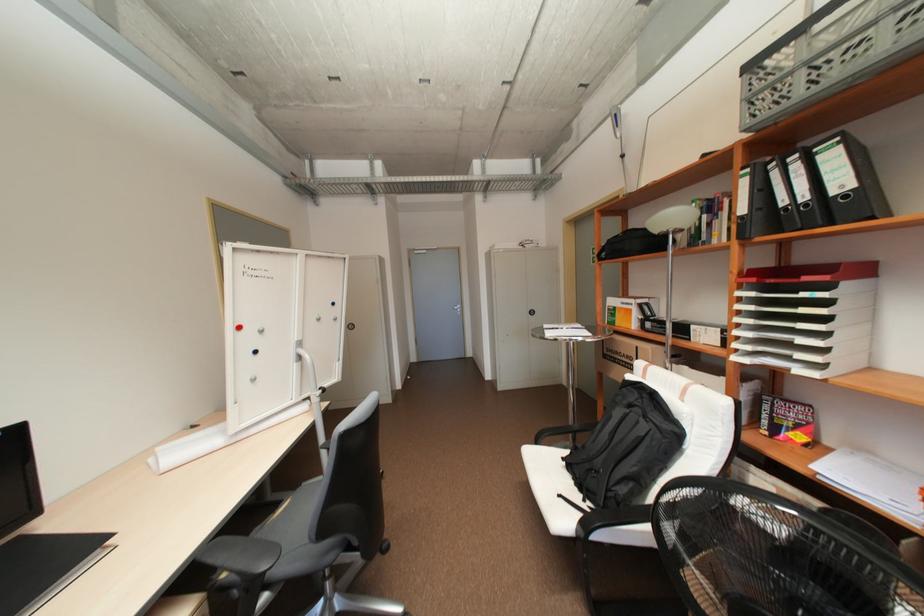
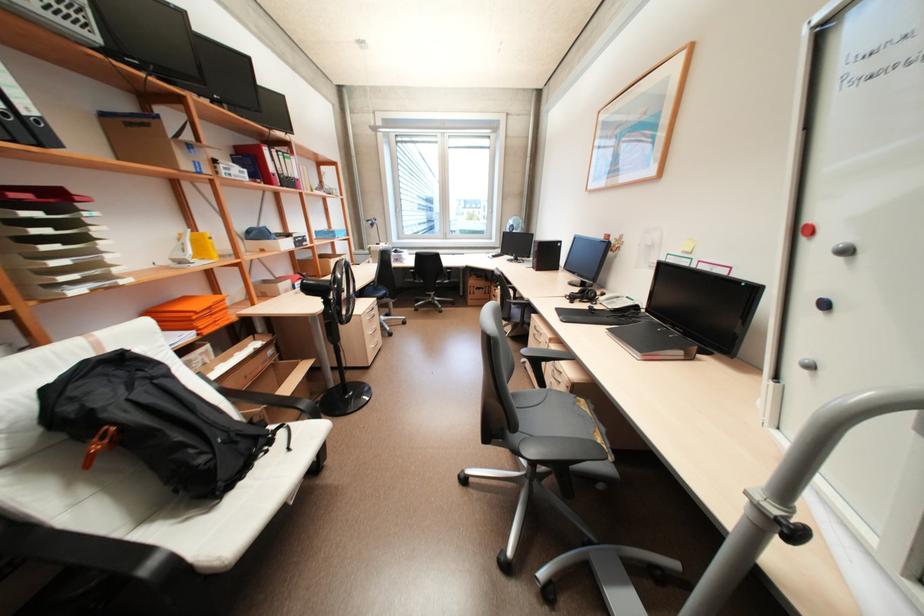
In the second image, find the point that corresponds to [261,352] in the first image.

(830, 304)